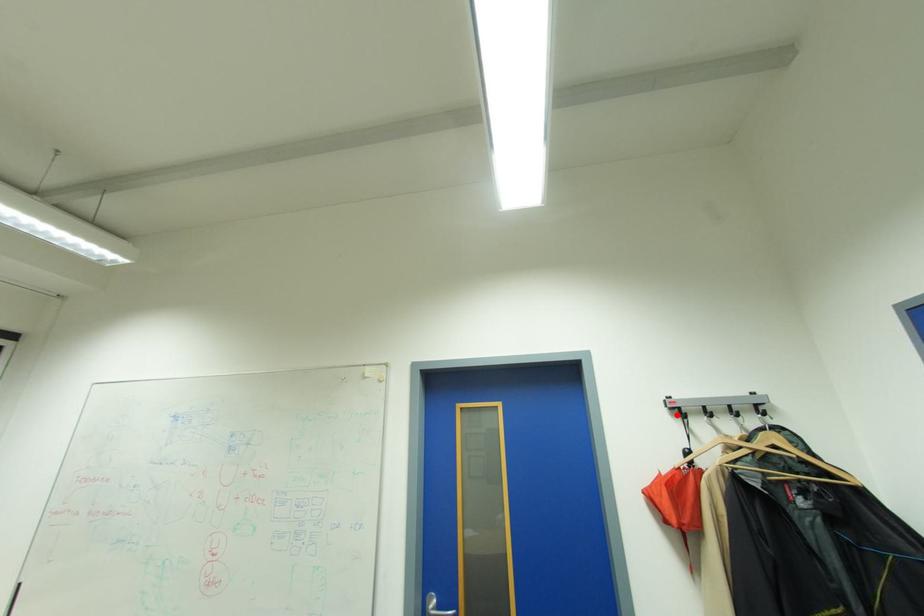
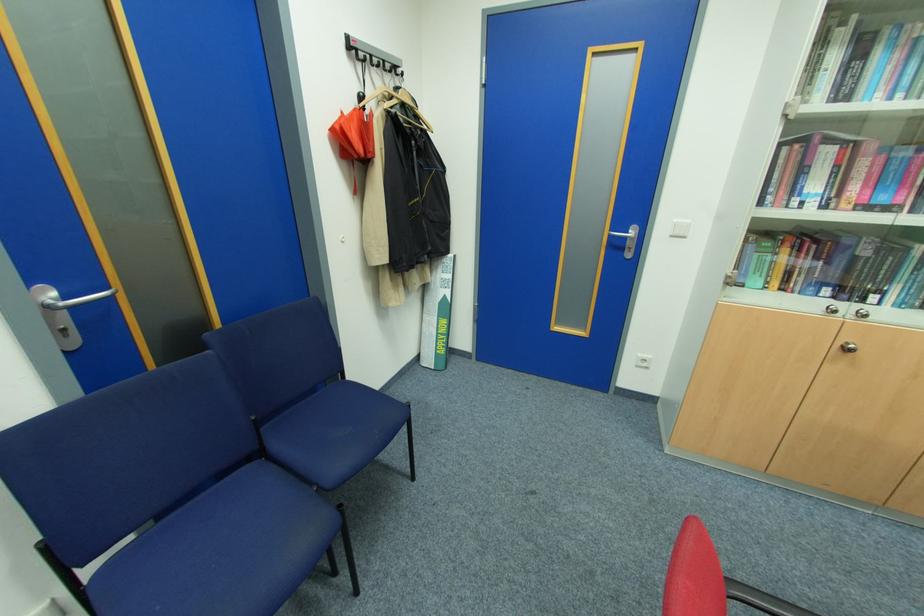
Where in the second image is the point corresponding to the highlighted location from the first image?

(353, 55)